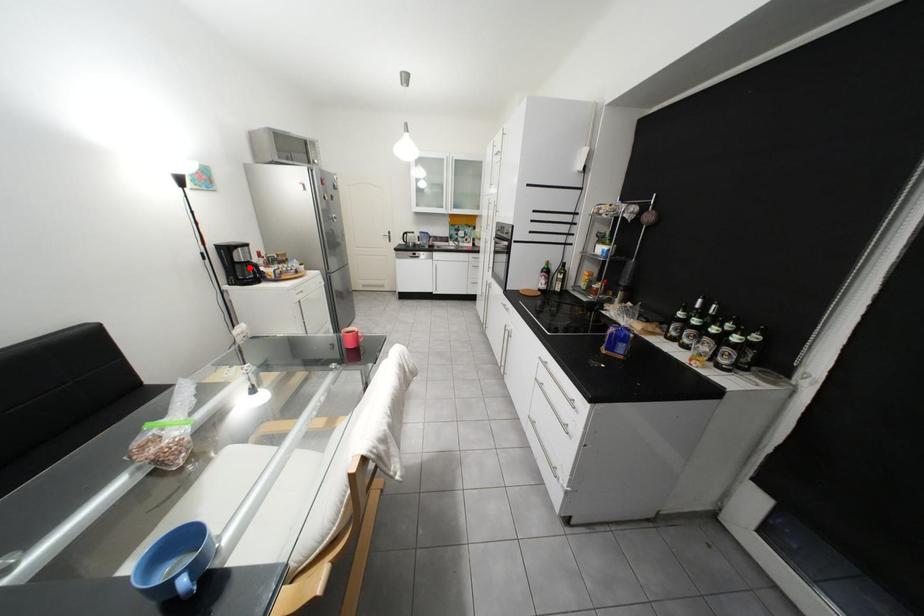
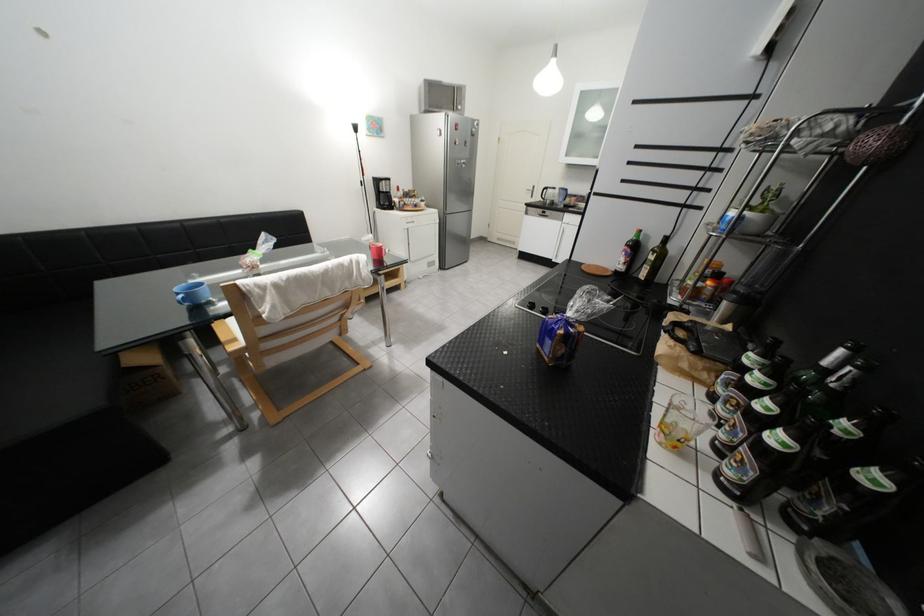
The point at the highlighted location is marked in the first image. Where is the corresponding point in the second image?

(393, 196)